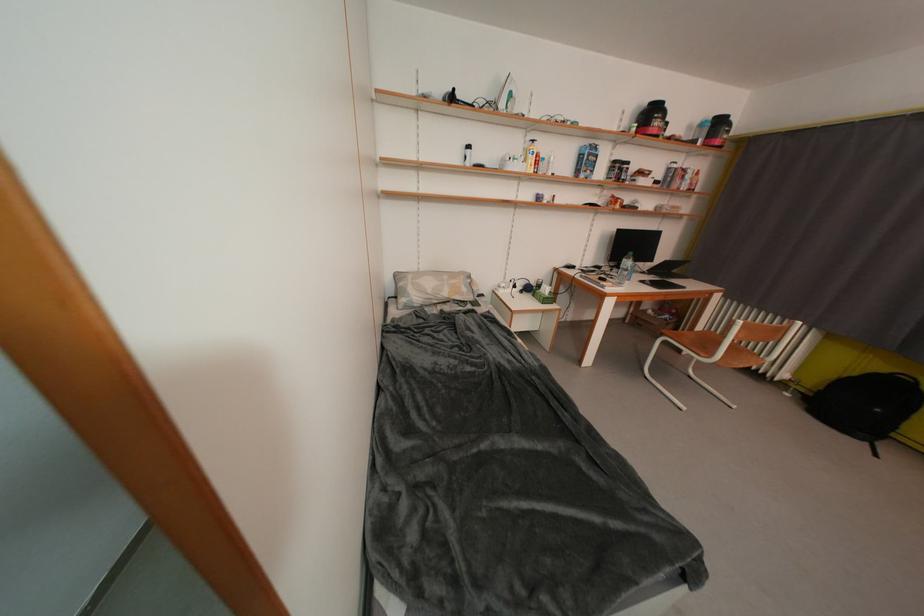
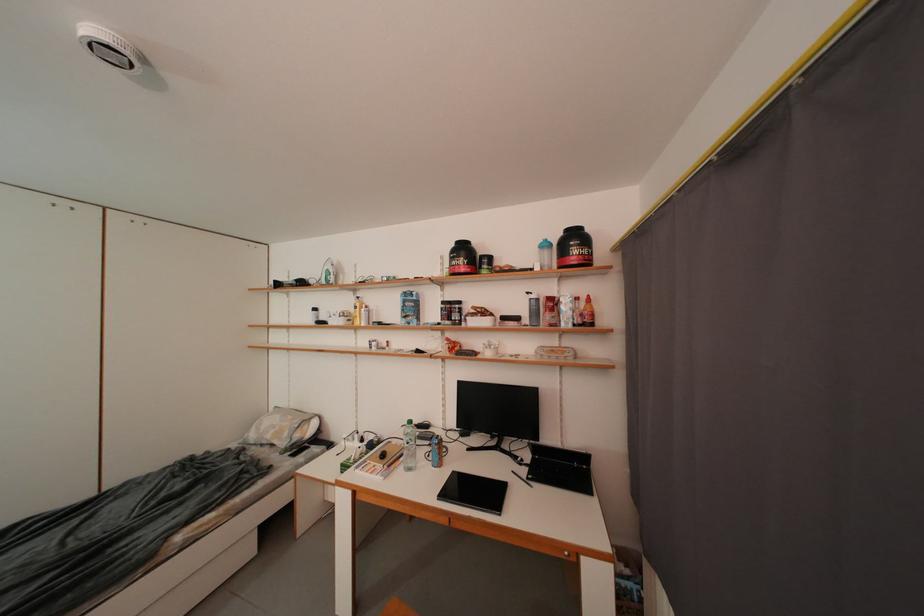
Where in the second image is the point corresponding to pixel 610 283 from the first image?

(391, 459)